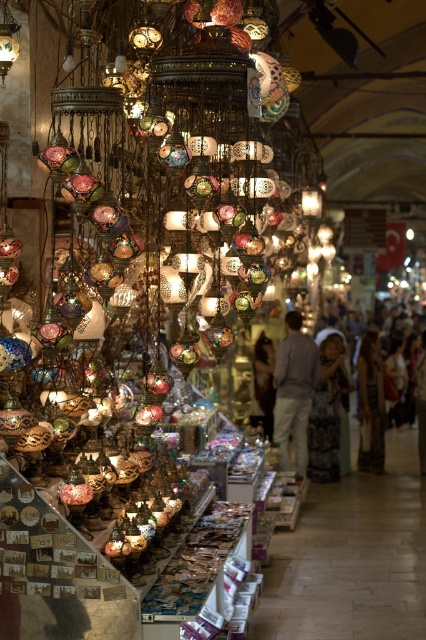
You are a customer in the market and want to purchase the silky white dress at center. However, you are standing at the entrance of the market, which is 10 meters away from the dress. Can you reach the dress without moving closer?

The silky white dress at center is 12.70 meters away from you, so you cannot reach it without moving closer since you are currently 10 meters away from it.

You are standing in the market and see a point at coordinates (293, 392). According to the scene description, what object is located at that point?

The point at coordinates (293, 392) is located on the light brown cotton shirt at center.